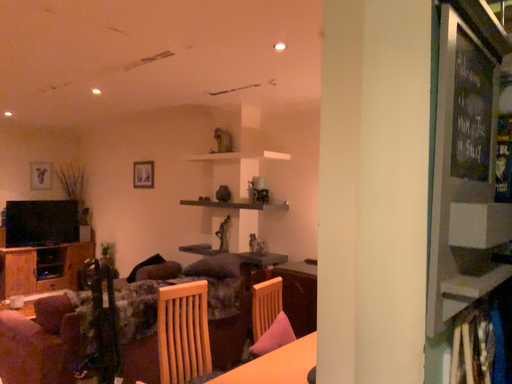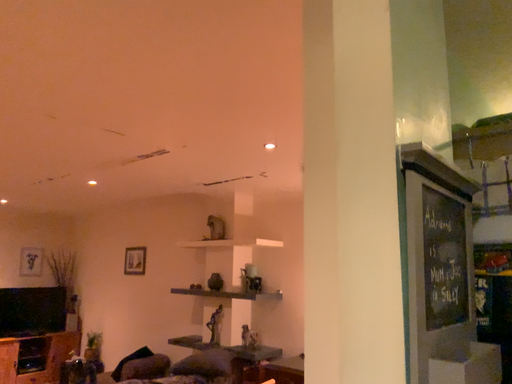
Question: Which way did the camera rotate in the video?

Choices:
 (A) rotated downward
 (B) rotated upward

Answer: (B)